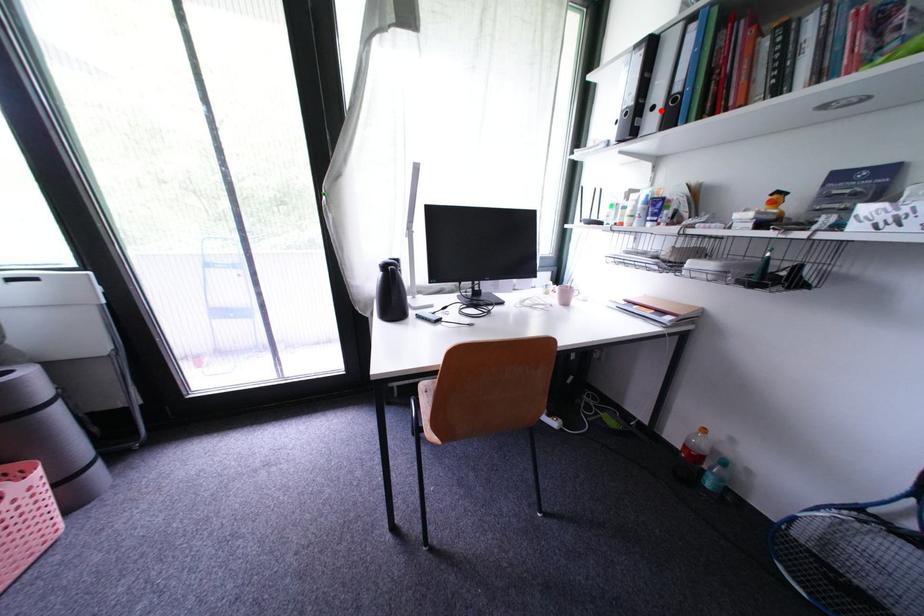
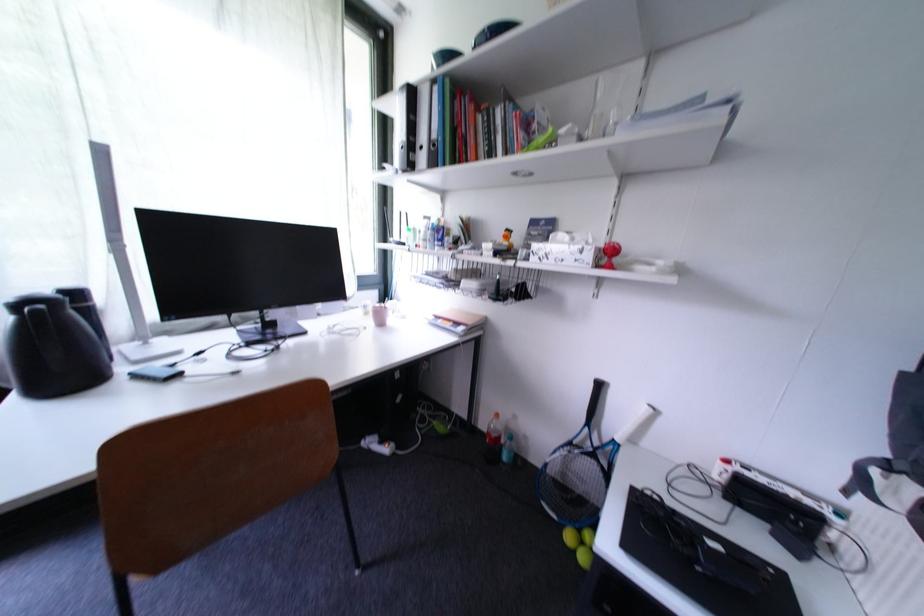
Locate, in the second image, the point that corresponds to the highlighted location in the first image.

(430, 150)